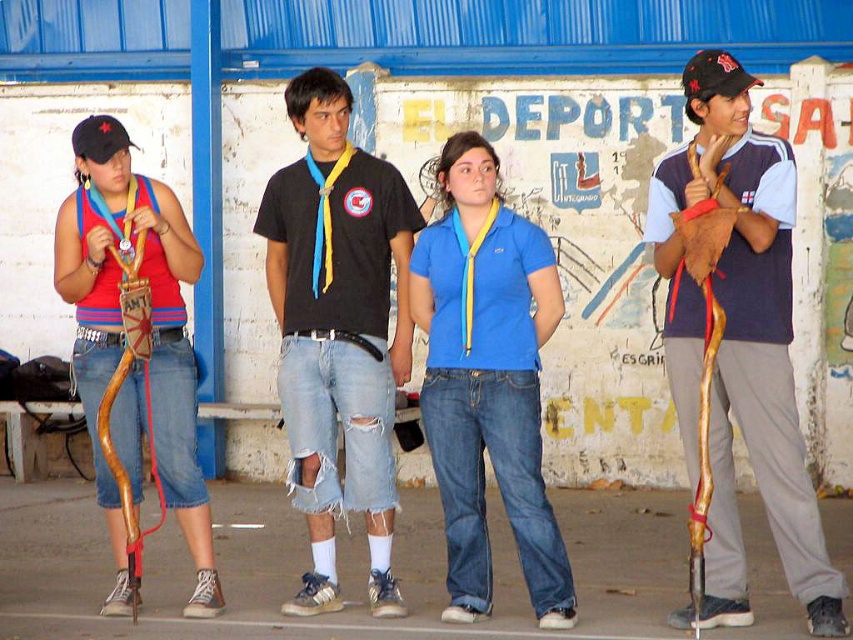
You are a scout leader assessing the height of the blue cotton shirt at center and the matte brown wooden bow at left in the image. Which object is taller?

The matte brown wooden bow at left is taller than the blue cotton shirt at center.